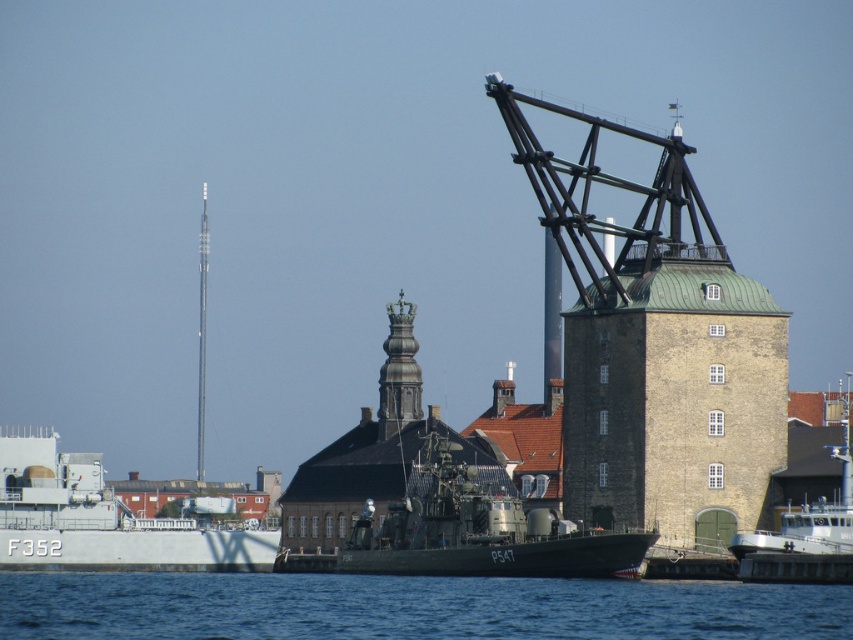
You are a sailor on the green matte military boat at center. You want to see the view of the white matte boat at center. Can you see it from your current position?

The white matte boat at center is behind the green matte military boat at center, so you cannot see it from your current position.

You are a maritime photographer planning to capture both the white matte ship at left and the white matte boat at center in a single wide shot. Given their sizes, which vessel should you position closer to the camera to ensure both appear balanced in the final image?

The white matte ship at left is larger than the white matte boat at center. To balance their sizes in the photo, position the smaller white matte boat at center closer to the camera while keeping the larger white matte ship at left farther back.

You are standing on the dock and want to take a photo of the green matte military boat at center. The camera you have can focus on objects up to 400 feet away. Will the boat be in focus?

The green matte military boat at center and camera are 357.39 feet apart from each other. Since the camera can focus up to 400 feet, the boat is within the focus range and will be in focus.